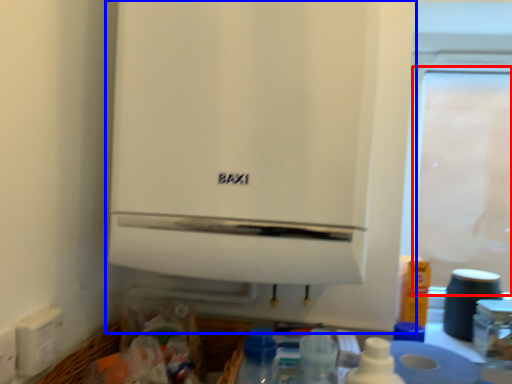
Question: Which object is further to the camera taking this photo, screen door (highlighted by a red box) or home appliance (highlighted by a blue box)?

Choices:
 (A) screen door
 (B) home appliance

Answer: (A)